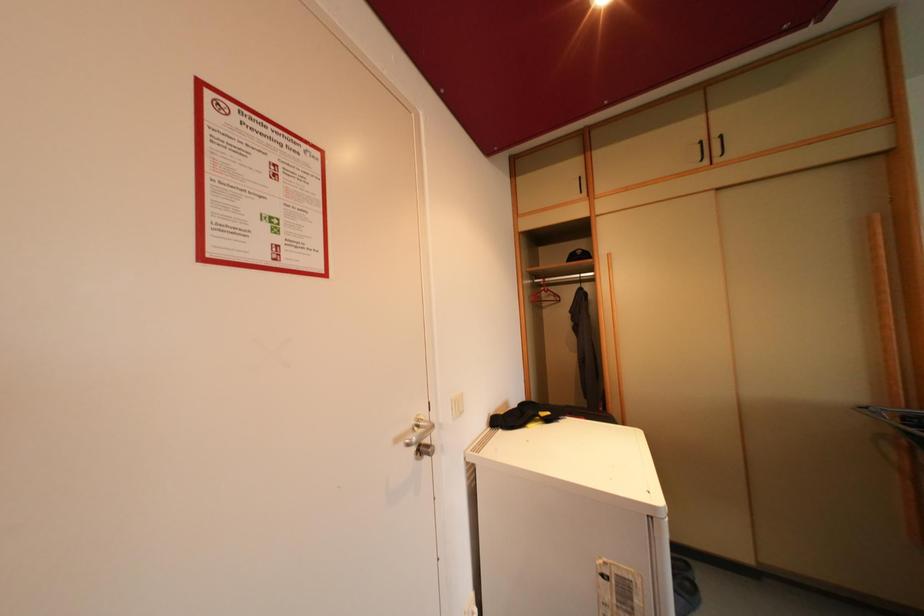
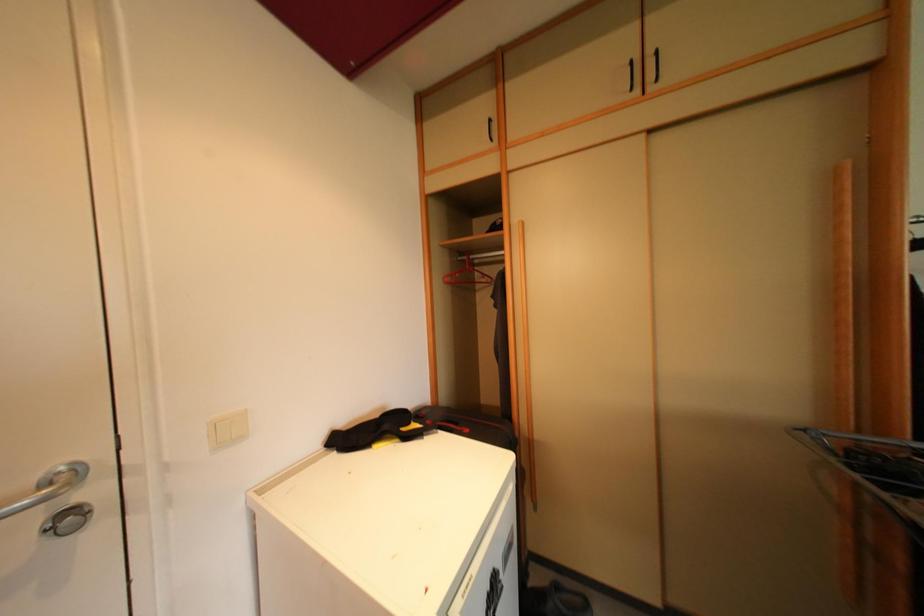
What movement of the cameraman would produce the second image?

The cameraman walked toward right, forward.